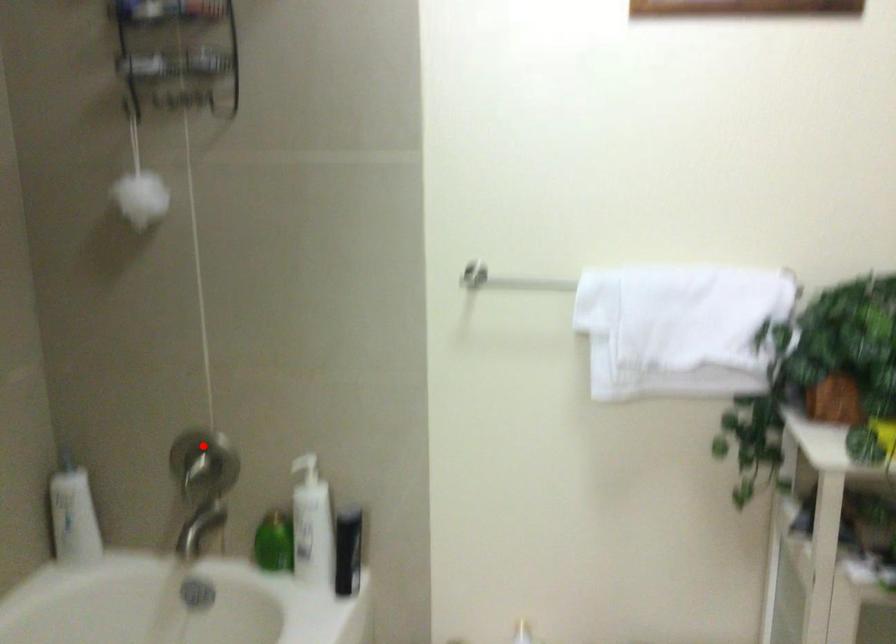
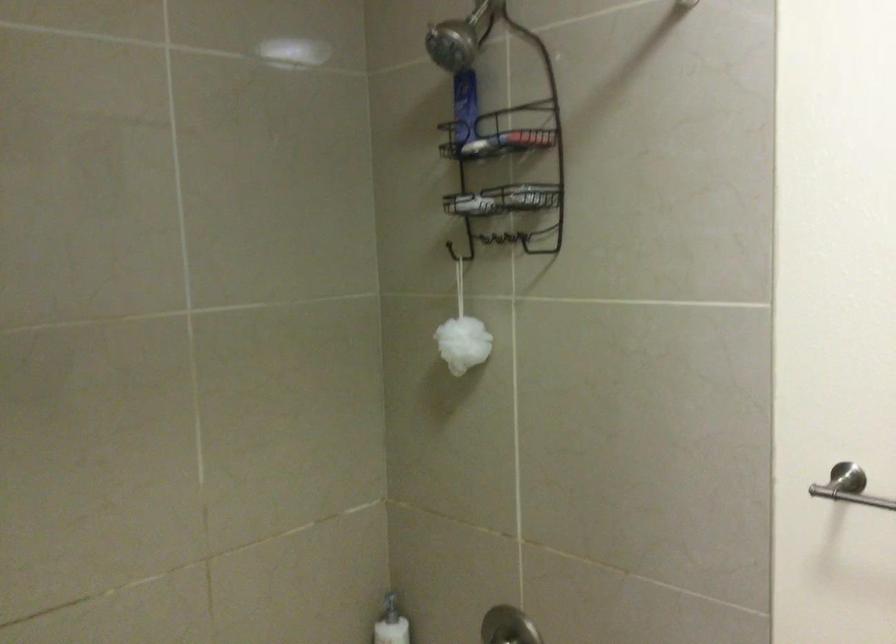
Locate, in the second image, the point that corresponds to the highlighted location in the first image.

(506, 627)